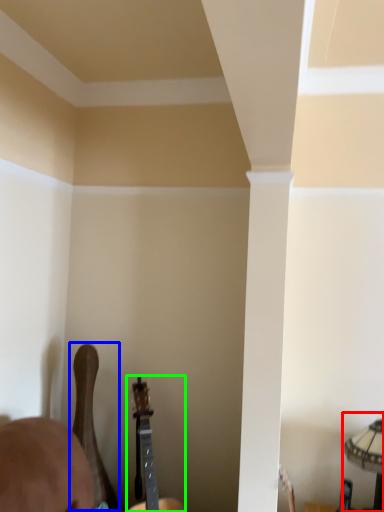
Question: Which object is the closest to the lamp (highlighted by a red box)? Choose among these: guitar (highlighted by a blue box) or guitar (highlighted by a green box).

Choices:
 (A) guitar
 (B) guitar

Answer: (B)